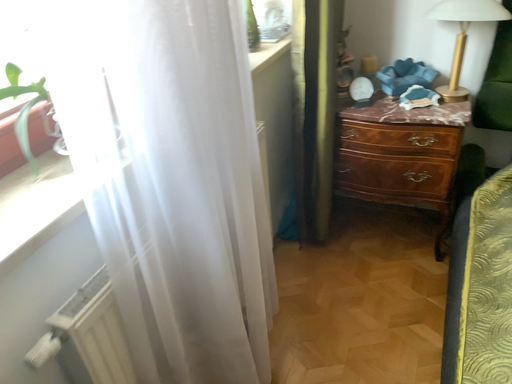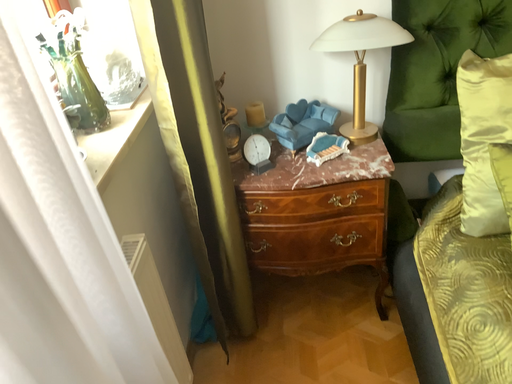
Question: How did the camera likely rotate when shooting the video?

Choices:
 (A) rotated left
 (B) rotated right

Answer: (B)